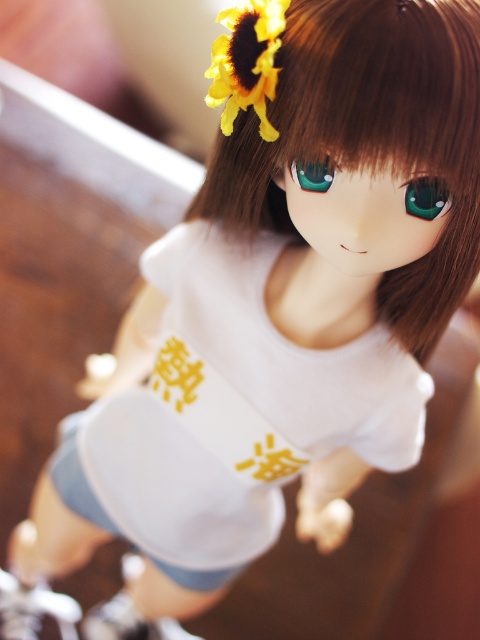
Question: Which of these objects is positioned closest to the yellow matte sunflower at upper center?

Choices:
 (A) white matte t-shirt at center
 (B) brown smooth hair at center

Answer: (B)

Question: Is white matte t-shirt at center further to the viewer compared to brown smooth hair at center?

Choices:
 (A) no
 (B) yes

Answer: (B)

Question: Which object appears closest to the camera in this image?

Choices:
 (A) brown smooth hair at center
 (B) yellow matte sunflower at upper center

Answer: (A)

Question: Among these objects, which one is farthest from the camera?

Choices:
 (A) white matte t-shirt at center
 (B) yellow matte sunflower at upper center
 (C) brown smooth hair at center

Answer: (A)

Question: In this image, where is white matte t-shirt at center located relative to brown smooth hair at center?

Choices:
 (A) left
 (B) right

Answer: (A)

Question: Can you confirm if brown smooth hair at center is wider than yellow matte sunflower at upper center?

Choices:
 (A) no
 (B) yes

Answer: (B)